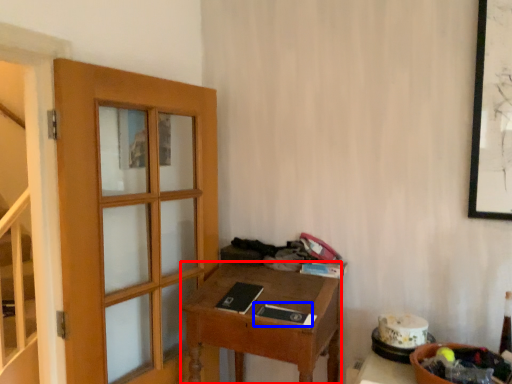
Question: Which of the following is the farthest to the observer, desk (highlighted by a red box) or book (highlighted by a blue box)?

Choices:
 (A) desk
 (B) book

Answer: (B)